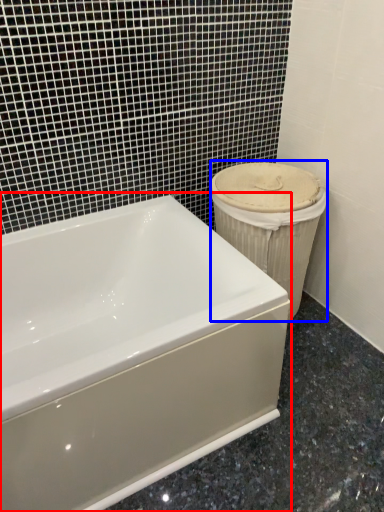
Question: Which of the following is the farthest to the observer, bathtub (highlighted by a red box) or porcelain (highlighted by a blue box)?

Choices:
 (A) bathtub
 (B) porcelain

Answer: (B)